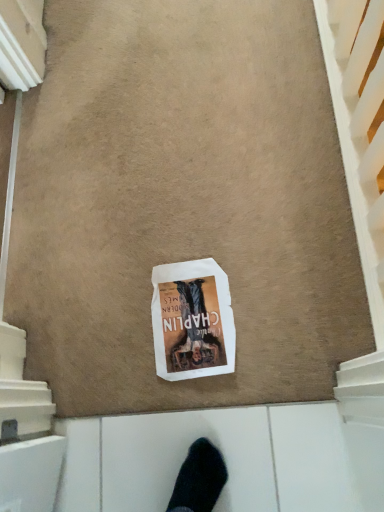
I want to click on free space above white paper bag at center (from a real-world perspective), so click(x=187, y=317).